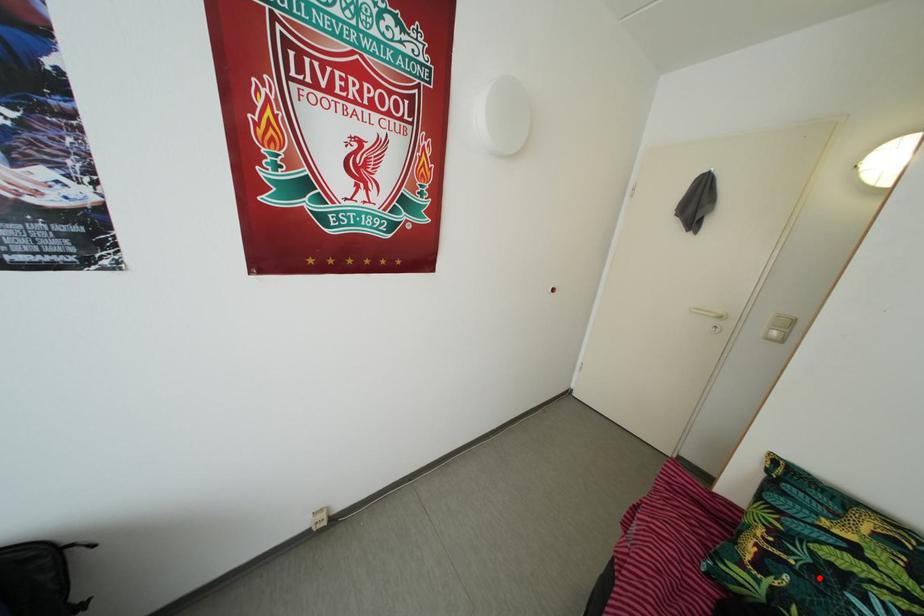
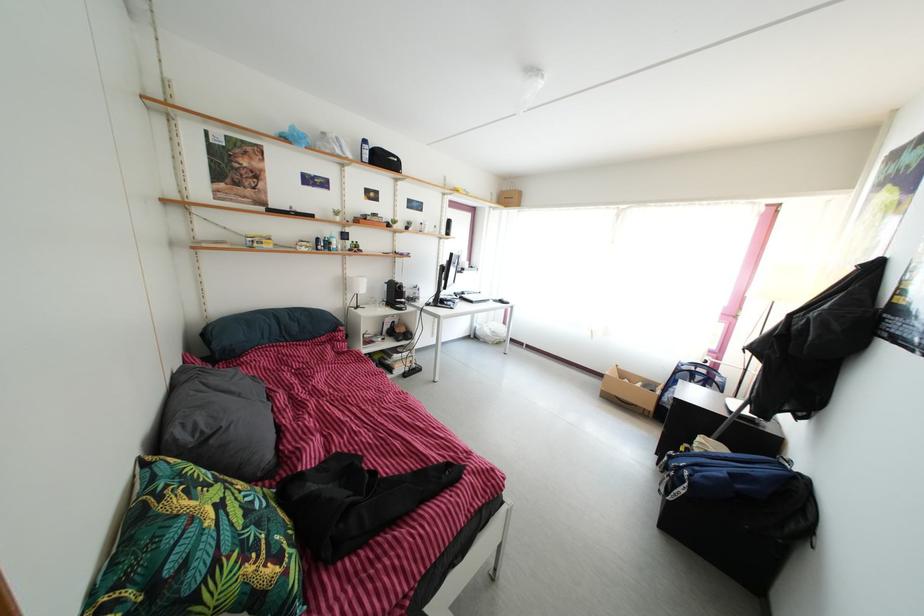
Question: A red point is marked in image1. In image2, is the corresponding 3D point closer to the camera or farther? Reply with the corresponding letter.

Choices:
 (A) The corresponding 3D point is closer.
 (B) The corresponding 3D point is farther.

Answer: (B)